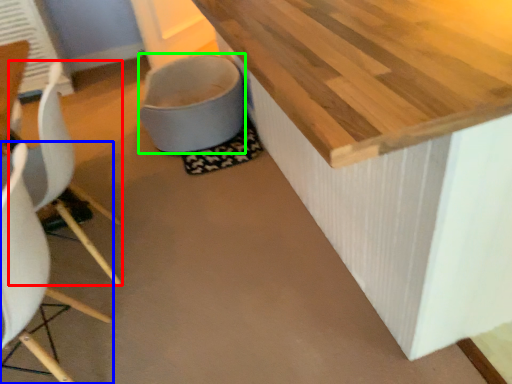
Question: Considering the real-world distances, which object is closest to chair (highlighted by a red box)? chair (highlighted by a blue box) or toilet bowl (highlighted by a green box).

Choices:
 (A) chair
 (B) toilet bowl

Answer: (A)